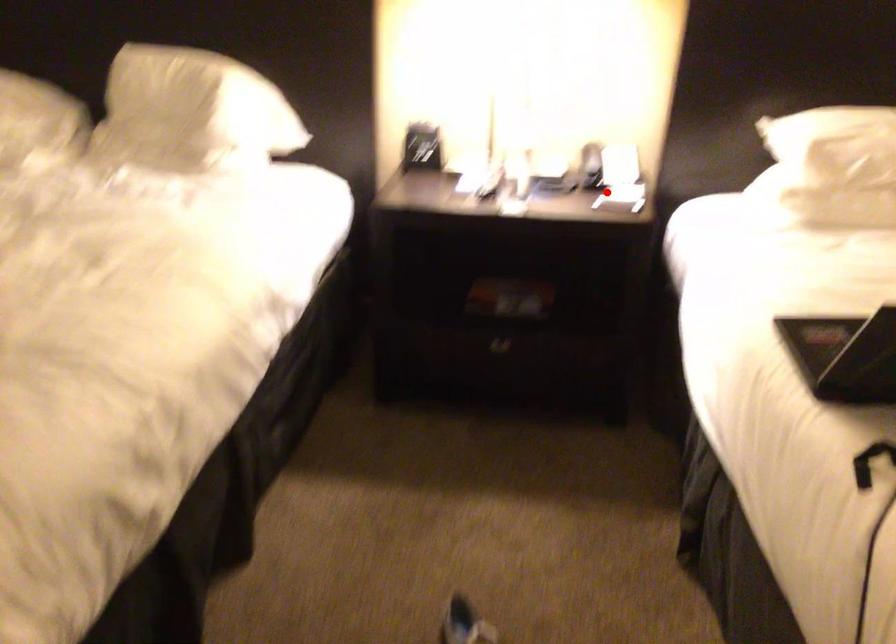
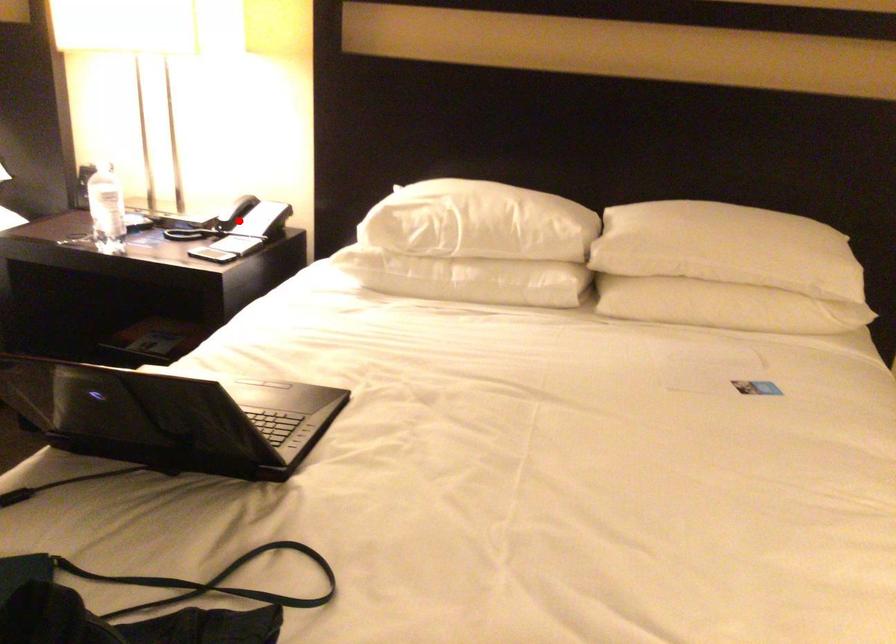
I am providing you with two images of the same scene from different viewpoints. A red point is marked on the first image and another point is marked on the second image. Are the points marked in image1 and image2 representing the same 3D position?

No